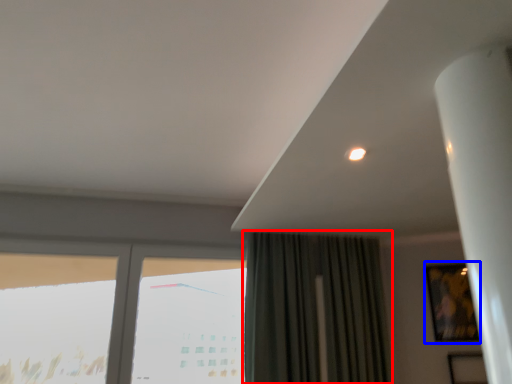
Question: Which of the following is the closest to the observer, curtain (highlighted by a red box) or picture frame (highlighted by a blue box)?

Choices:
 (A) curtain
 (B) picture frame

Answer: (A)